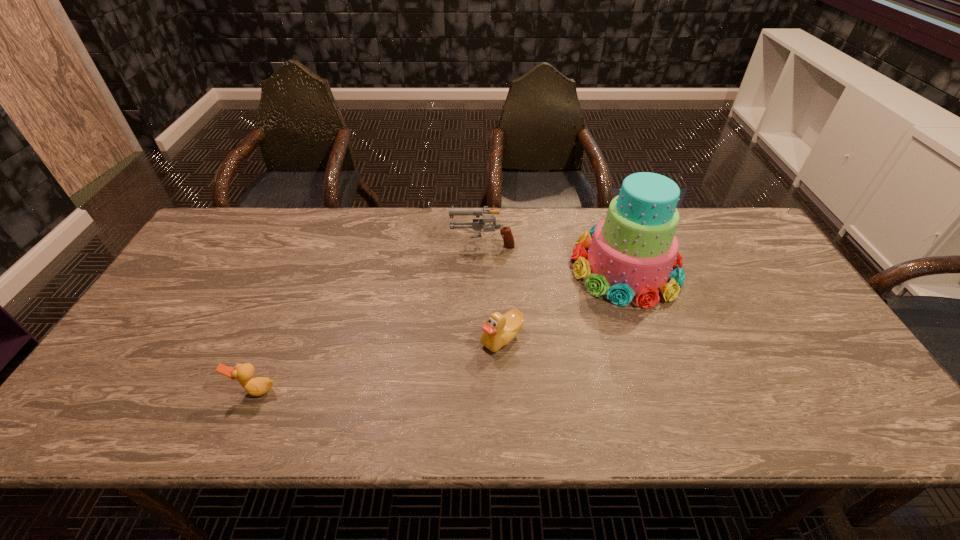
Identify the location of free location at the near right corner of the desktop. This screenshot has height=540, width=960. (847, 406).

Find the location of a particular element. This screenshot has width=960, height=540. free space between the left duck and the cake is located at coordinates (441, 329).

Identify the location of vacant space that's between the right duck and the gun. (492, 291).

Locate an element on the screen. The height and width of the screenshot is (540, 960). free spot between the left duck and the gun is located at coordinates (369, 316).

Identify the location of vacant point located between the gun and the nearer duck. (369, 316).

Where is `free space between the gun and the farther duck`? free space between the gun and the farther duck is located at coordinates (492, 291).

Where is `free space between the tallest object and the leftmost object`? This screenshot has width=960, height=540. free space between the tallest object and the leftmost object is located at coordinates (441, 329).

Find the location of a particular element. free space between the nearest object and the second nearest object is located at coordinates (378, 364).

Where is `vacant point located between the rightmost object and the nearer duck`? This screenshot has height=540, width=960. vacant point located between the rightmost object and the nearer duck is located at coordinates (441, 329).

At what (x,y) coordinates should I click in order to perform the action: click on empty space that is in between the farther duck and the nearer duck. Please return your answer as a coordinate pair (x, y). The width and height of the screenshot is (960, 540). Looking at the image, I should click on (378, 364).